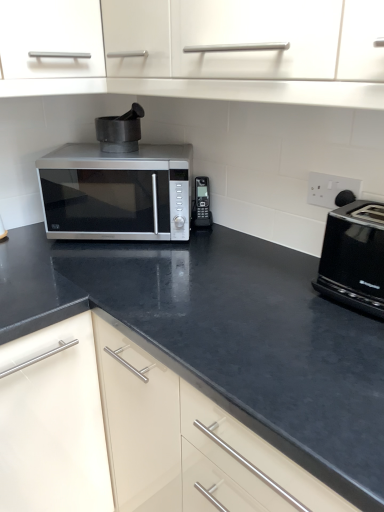
Identify the location of free spot above satin silver microwave at center (from a real-world perspective). The image size is (384, 512). (127, 154).